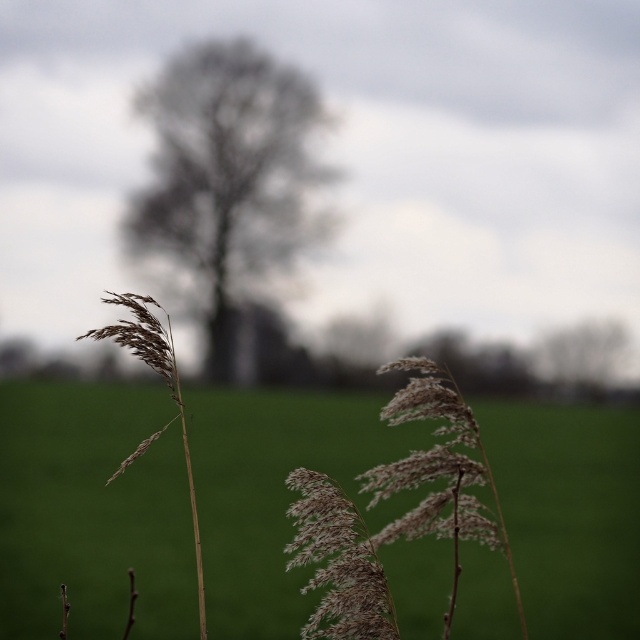
You are a photographer standing in the field. You want to capture a photo where the white fluffy grass at center is in focus while keeping the dark brown textured tree at center blurred in the background. Based on the scene description, is this possible?

Yes, because the white fluffy grass at center is below the dark brown textured tree at center, creating a natural depth of field where the foreground grass can be in focus while the tree remains blurred in the background.